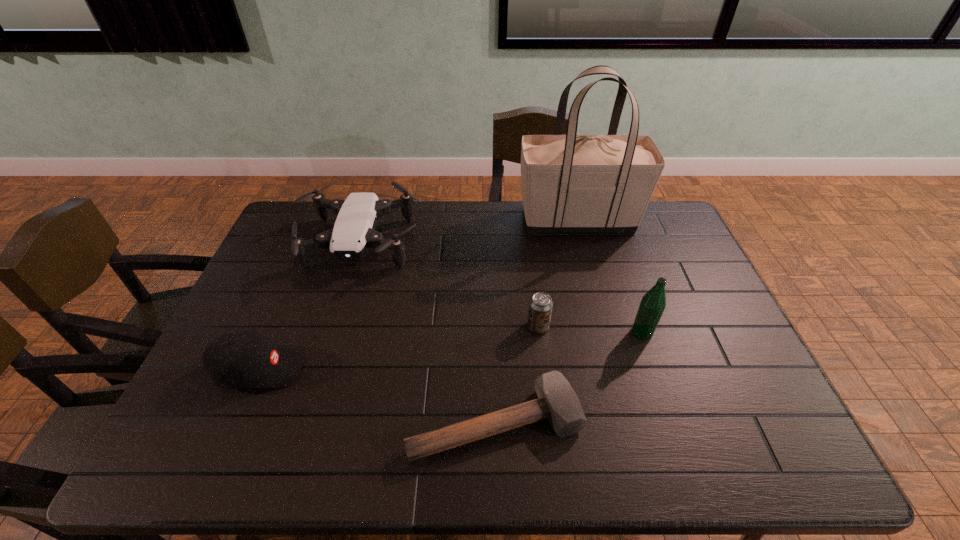
This screenshot has height=540, width=960. Identify the location of the tallest object. (571, 183).

I want to click on bottle, so click(653, 303).

Identify the location of drone. (354, 232).

The width and height of the screenshot is (960, 540). Find the location of `beer can`. beer can is located at coordinates (540, 306).

Locate an element on the screen. The image size is (960, 540). baseball cap is located at coordinates (245, 358).

Find the location of a particular element. The image size is (960, 540). mallet is located at coordinates (557, 401).

What are the coordinates of `vacant space situated with handles facing forward on the shopping bag` in the screenshot? It's located at [427, 220].

The width and height of the screenshot is (960, 540). I want to click on free point located 0.240m with handles facing forward on the shopping bag, so click(451, 220).

The height and width of the screenshot is (540, 960). I want to click on blank space located 0.320m with handles facing forward on the shopping bag, so click(x=429, y=220).

The height and width of the screenshot is (540, 960). I want to click on vacant area situated 0.380m on the back of the bottle, so click(611, 240).